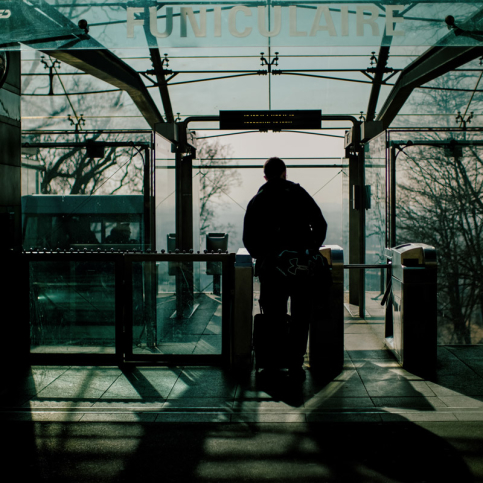
The image size is (483, 483). Identify the location of tiled floor. (401, 381).